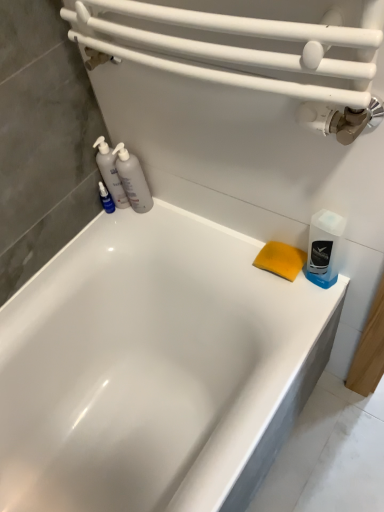
Question: Is point (334, 244) closer or farther from the camera than point (117, 244)?

Choices:
 (A) closer
 (B) farther

Answer: (A)

Question: In the image, is blue translucent bottle at right, which is the first cleaning product in right-to-left order, positioned in front of or behind white glossy bathtub at center?

Choices:
 (A) front
 (B) behind

Answer: (B)

Question: Based on their relative distances, which object is nearer to the blue translucent bottle at left?

Choices:
 (A) blue translucent bottle at right, which is the first cleaning product in right-to-left order
 (B) translucent plastic bottles at left, the second cleaning product in the right-to-left sequence
 (C) white glossy bathtub at center
 (D) translucent plastic bottles at left, which ranks as the third cleaning product in right-to-left order

Answer: (D)

Question: Estimate the real-world distances between objects in this image. Which object is closer to the blue translucent bottle at left?

Choices:
 (A) translucent plastic bottles at left, marked as the second cleaning product in a left-to-right arrangement
 (B) blue translucent bottle at right, which is counted as the third cleaning product, starting from the left
 (C) translucent plastic bottles at left, which ranks as the third cleaning product in right-to-left order
 (D) white glossy bathtub at center

Answer: (C)